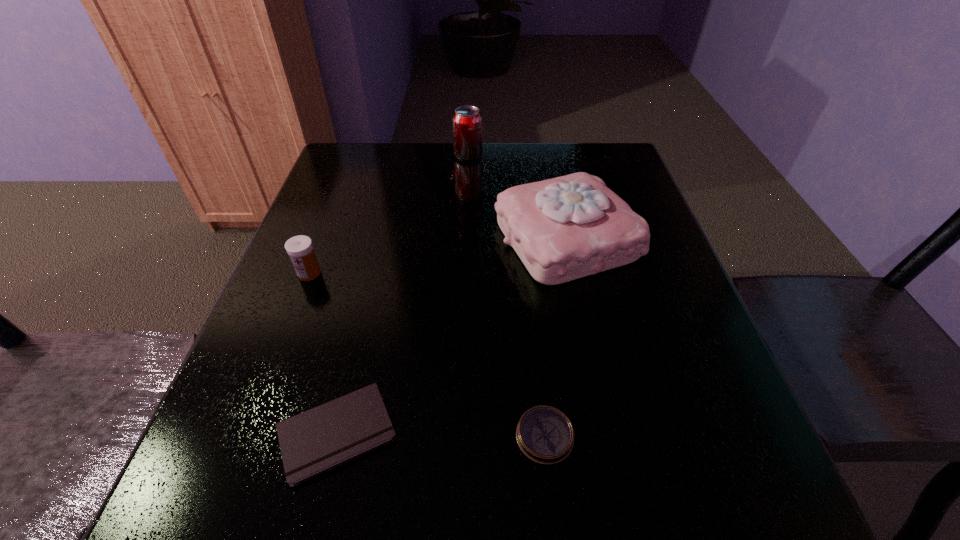
Locate an element on the screen. The width and height of the screenshot is (960, 540). free space at the near edge is located at coordinates (384, 464).

This screenshot has width=960, height=540. In the image, there is a desktop. What are the coordinates of `vacant space at the left edge` in the screenshot? It's located at (331, 193).

Where is `blank space at the right edge of the desktop`? blank space at the right edge of the desktop is located at coordinates (657, 282).

At what (x,y) coordinates should I click in order to perform the action: click on vacant region at the far left corner. Please return your answer as a coordinate pair (x, y). Image resolution: width=960 pixels, height=540 pixels. Looking at the image, I should click on click(x=350, y=165).

What are the coordinates of `free location at the near left corner` in the screenshot? It's located at (177, 525).

In the image, there is a desktop. Identify the location of free space at the far right corner. (587, 156).

Identify the location of free space between the compass and the checkbook. (441, 434).

Locate an element on the screen. free space that is in between the third object from right to left and the leftmost object is located at coordinates (389, 214).

In order to click on free spot between the third object from right to left and the medicine in this screenshot , I will do `click(389, 214)`.

Locate an element on the screen. This screenshot has height=540, width=960. vacant region between the compass and the cake is located at coordinates point(556,338).